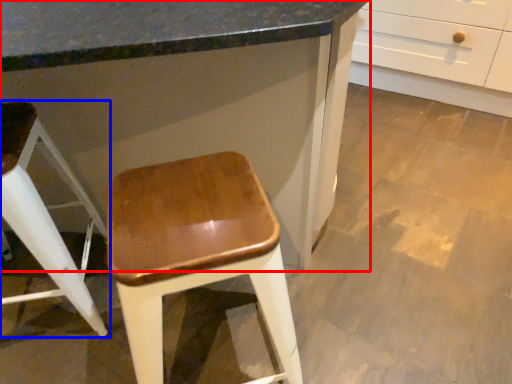
Question: Among these objects, which one is nearest to the camera, cabinetry (highlighted by a red box) or stool (highlighted by a blue box)?

Choices:
 (A) cabinetry
 (B) stool

Answer: (A)